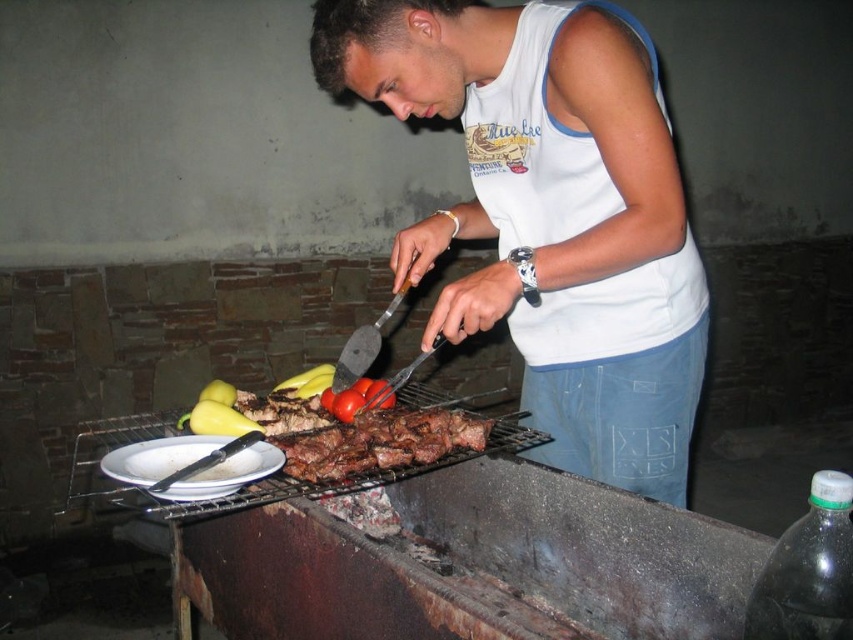
Question: Does white cotton tank top at center appear on the right side of brown charred meat at center?

Choices:
 (A) no
 (B) yes

Answer: (B)

Question: Based on their relative distances, which object is nearer to the white cotton tank top at center?

Choices:
 (A) yellow smooth pepper at lower left
 (B) brown charred meat at center
 (C) metallic silver tong at lower left

Answer: (B)

Question: Can you confirm if brown charred meat at center is thinner than metallic silver tong at lower left?

Choices:
 (A) no
 (B) yes

Answer: (A)

Question: Among these objects, which one is farthest from the camera?

Choices:
 (A) brown charred meat at center
 (B) white cotton tank top at center
 (C) metallic silver tong at lower left

Answer: (A)

Question: Estimate the real-world distances between objects in this image. Which object is closer to the yellow smooth pepper at lower left?

Choices:
 (A) brown charred meat at center
 (B) metallic silver tong at lower left
 (C) white cotton tank top at center

Answer: (A)

Question: Can you confirm if white cotton tank top at center is thinner than metallic silver tong at lower left?

Choices:
 (A) yes
 (B) no

Answer: (B)